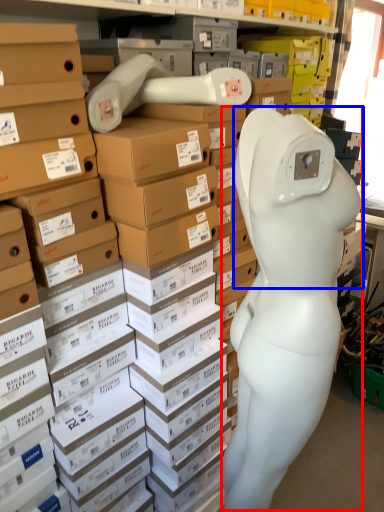
Question: Which object appears closest to the camera in this image, worker (highlighted by a red box) or head (highlighted by a blue box)?

Choices:
 (A) worker
 (B) head

Answer: (A)